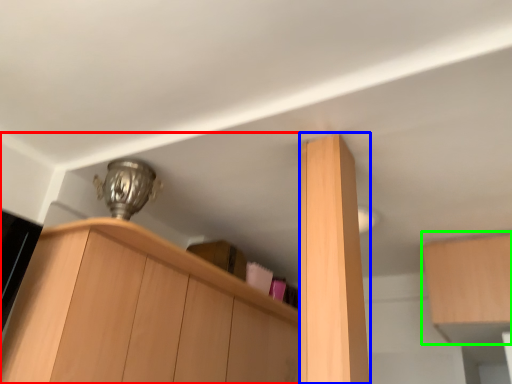
Question: Which object is the closest to the cabinetry (highlighted by a red box)? Choose among these: cabinetry (highlighted by a blue box) or cabinetry (highlighted by a green box).

Choices:
 (A) cabinetry
 (B) cabinetry

Answer: (A)